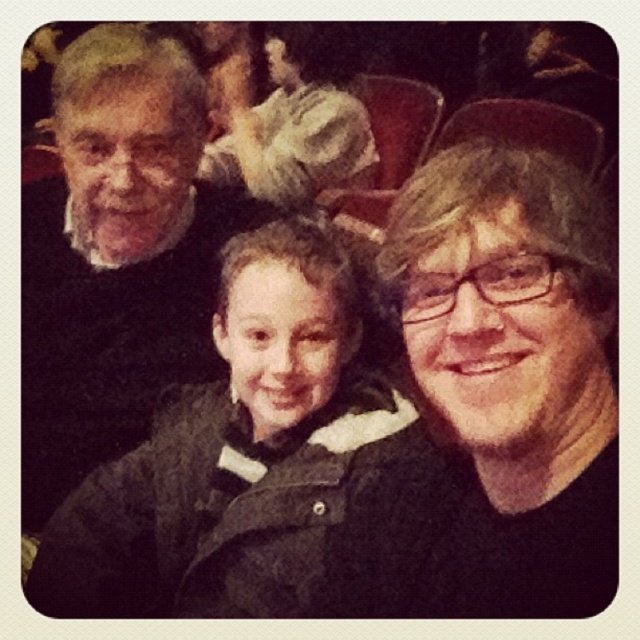
You are trying to decide which item to grab first between the dark gray fuzzy coat at center and the fuzzy fabric flower at upper center. Based on their sizes, which one do you think is easier to reach?

The dark gray fuzzy coat at center is thinner than the fuzzy fabric flower at upper center, so it might be easier to reach the thinner dark gray fuzzy coat at center first.

You are trying to decide which item to place on a small shelf that can only hold one of them. Based on their sizes, which object from the dark gray fuzzy coat at center and the fuzzy fabric flower at upper center would you choose?

The dark gray fuzzy coat at center is smaller than the fuzzy fabric flower at upper center, so the dark gray fuzzy coat at center would fit better on the small shelf.